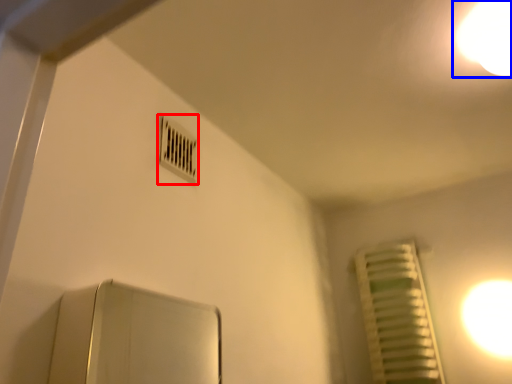
Question: Which object is closer to the camera taking this photo, air conditioning (highlighted by a red box) or light (highlighted by a blue box)?

Choices:
 (A) air conditioning
 (B) light

Answer: (B)